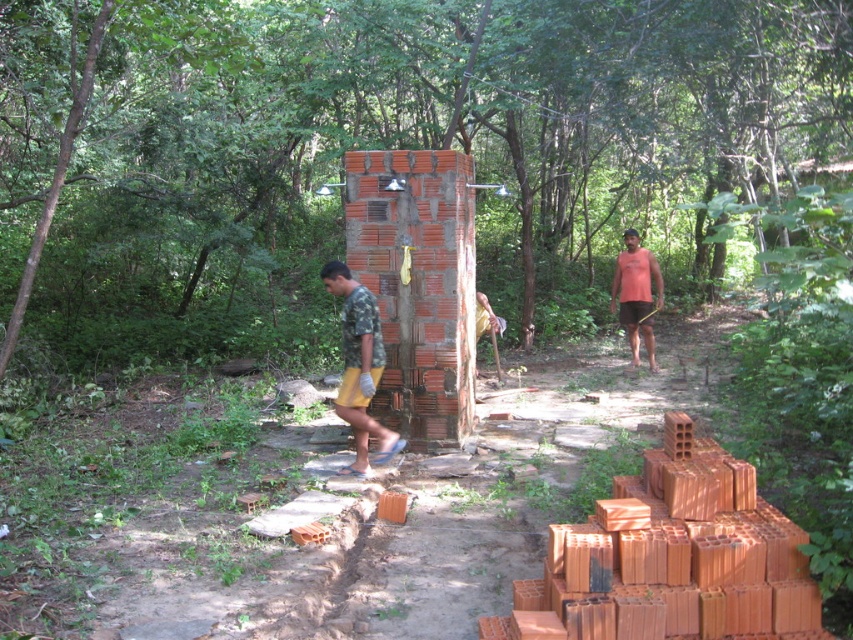
You are a GUI agent. You are given a task and a screenshot of the screen. Output one action in this format:
    pyautogui.click(x=<x>, y=<y>)
    Task: Click on the camouflage fabric shirt at center
    
    Given the screenshot: What is the action you would take?
    pyautogui.click(x=358, y=365)

I want to click on camouflage fabric shirt at center, so click(x=358, y=365).

Where is `camouflage fabric shirt at center`? The image size is (853, 640). camouflage fabric shirt at center is located at coordinates (358, 365).